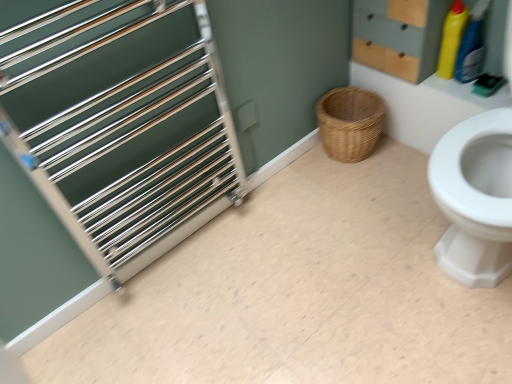
Question: Considering the positions of point (417, 279) and point (466, 11), is point (417, 279) closer or farther from the camera than point (466, 11)?

Choices:
 (A) farther
 (B) closer

Answer: (B)

Question: From a real-world perspective, is brushed metal towel rack at left positioned above or below yellow plastic bottle at upper right, which is the first cleaning product from left to right?

Choices:
 (A) above
 (B) below

Answer: (B)

Question: Estimate the real-world distances between objects in this image. Which object is farther from the brushed metal towel rack at left?

Choices:
 (A) yellow plastic bottle at upper right, arranged as the second cleaning product when viewed from the left
 (B) yellow plastic bottle at upper right, which is the first cleaning product from left to right
 (C) polished metal rack at left
 (D) wooden drawer at upper right
 (E) woven natural basket at lower center

Answer: (B)

Question: Which is nearer to the yellow plastic bottle at upper right, the 1th cleaning product when ordered from right to left?

Choices:
 (A) yellow plastic bottle at upper right, which is the first cleaning product from left to right
 (B) polished metal rack at left
 (C) woven natural basket at lower center
 (D) brushed metal towel rack at left
 (E) wooden drawer at upper right

Answer: (A)